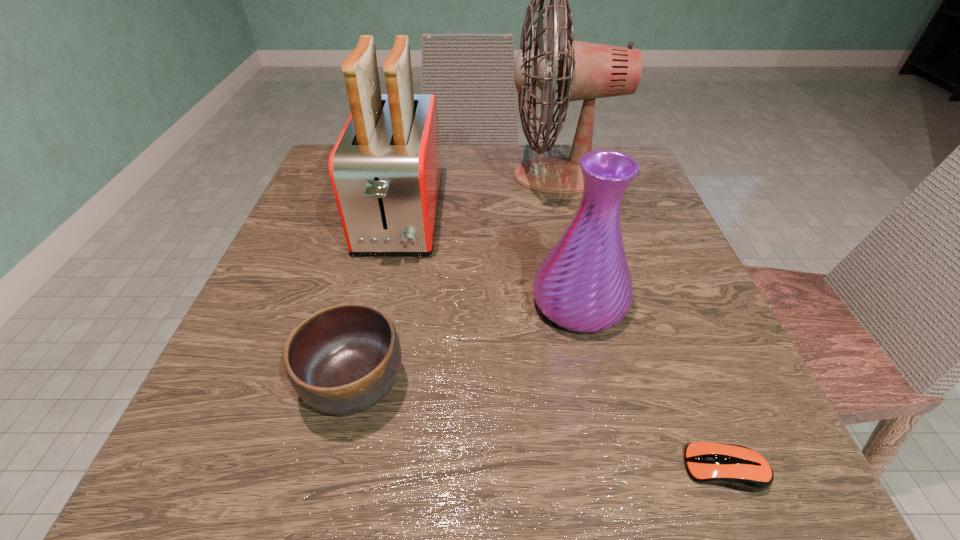
You are a GUI agent. You are given a task and a screenshot of the screen. Output one action in this format:
    pyautogui.click(x=<x>, y=<y>)
    Task: Click on the object that is the second closest to the shortest object
    This screenshot has width=960, height=540.
    Given the screenshot: What is the action you would take?
    pyautogui.click(x=343, y=359)

Identify the location of object that is the third closest to the tallest object. (343, 359).

What are the coordinates of `free spot that satisfies the following two spatial constraints: 1. in front of the tallest object to direct airflow; 2. on the front-facing side of the toaster` in the screenshot? It's located at (570, 216).

Locate an element on the screen. This screenshot has width=960, height=540. vacant point that satisfies the following two spatial constraints: 1. on the front-facing side of the nearest object; 2. on the left side of the second tallest object is located at coordinates (346, 469).

Where is `free spot that satisfies the following two spatial constraints: 1. on the front-facing side of the toaster; 2. on the left side of the third shortest object`? The width and height of the screenshot is (960, 540). free spot that satisfies the following two spatial constraints: 1. on the front-facing side of the toaster; 2. on the left side of the third shortest object is located at coordinates [381, 303].

Where is `free spot that satisfies the following two spatial constraints: 1. on the front-facing side of the computer mouse; 2. on the left side of the toaster`? This screenshot has width=960, height=540. free spot that satisfies the following two spatial constraints: 1. on the front-facing side of the computer mouse; 2. on the left side of the toaster is located at coordinates (346, 469).